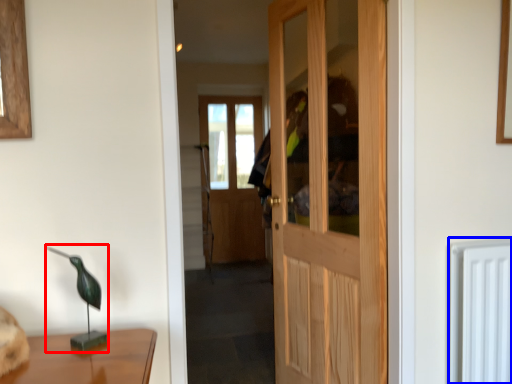
Question: Which point is closer to the camera, table lamp (highlighted by a red box) or radiator (highlighted by a blue box)?

Choices:
 (A) table lamp
 (B) radiator

Answer: (A)